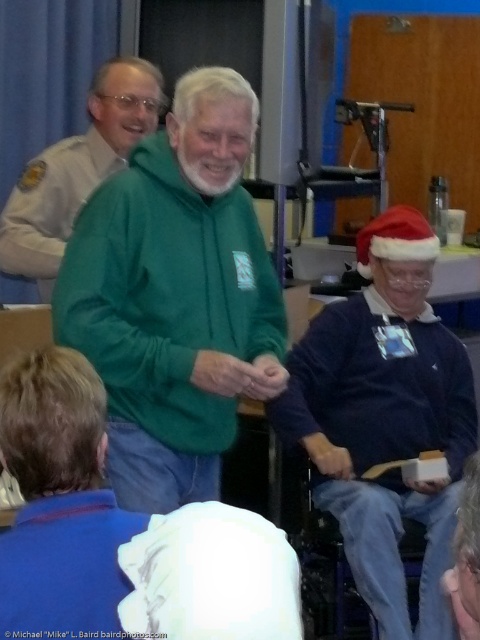
Question: Estimate the real-world distances between objects in this image. Which object is closer to the green fleece at center?

Choices:
 (A) blue sweater at lower right
 (B) green fleece jacket at center

Answer: (B)

Question: Does green fleece jacket at center have a larger size compared to blue sweater at lower right?

Choices:
 (A) yes
 (B) no

Answer: (B)

Question: Can you confirm if blue sweater at lower right is positioned below green fleece at center?

Choices:
 (A) yes
 (B) no

Answer: (A)

Question: Which point is farther to the camera?

Choices:
 (A) green fleece at center
 (B) green fleece jacket at center
 (C) blue sweater at lower right

Answer: (A)

Question: Which of these objects is positioned farthest from the green fleece at center?

Choices:
 (A) green fleece jacket at center
 (B) blue sweater at lower right

Answer: (B)

Question: Is green fleece jacket at center above blue sweater at lower right?

Choices:
 (A) yes
 (B) no

Answer: (A)